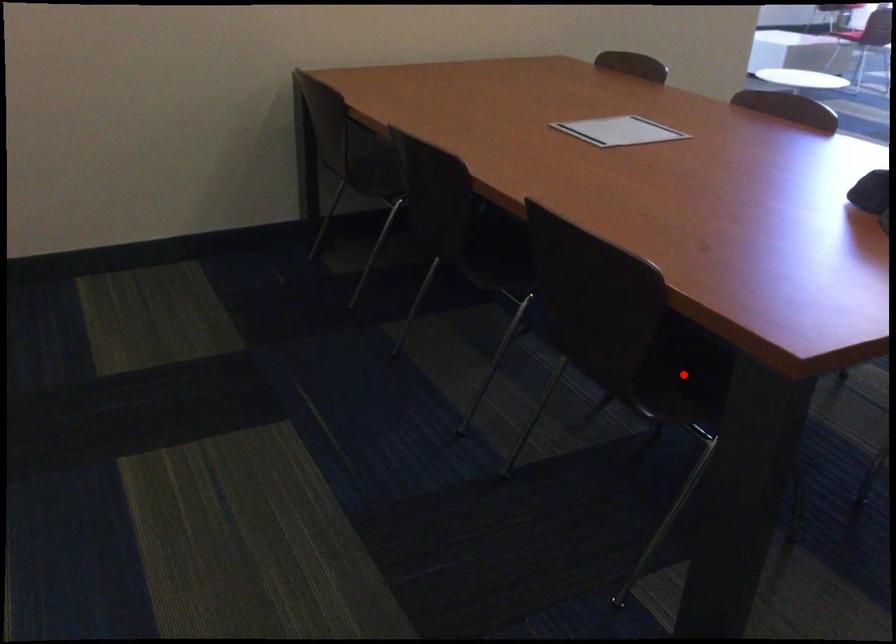
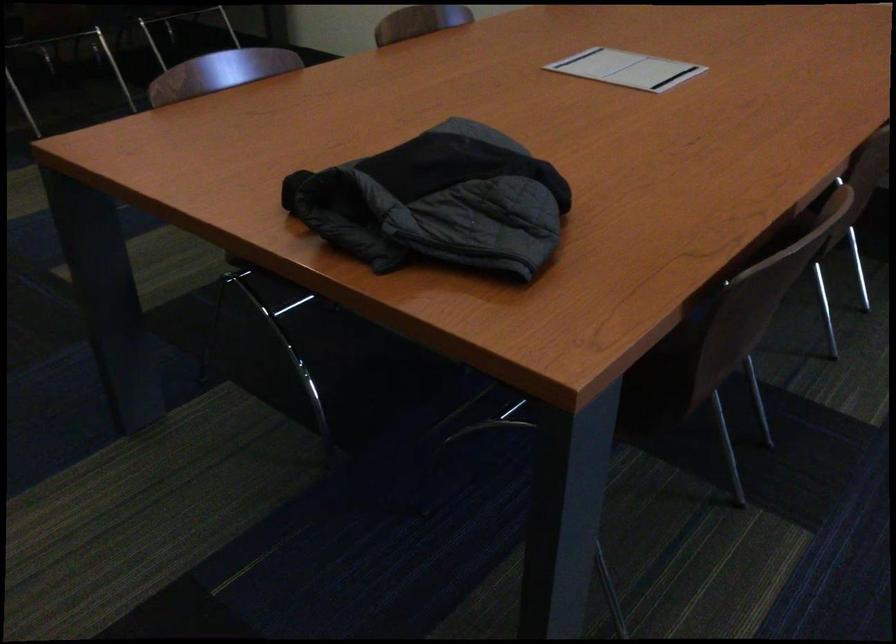
Question: I am providing you with two images of the same scene from different viewpoints. A red point is marked on the first image. Can you still see the location of the red point in image 2?

Choices:
 (A) Yes
 (B) No

Answer: (B)